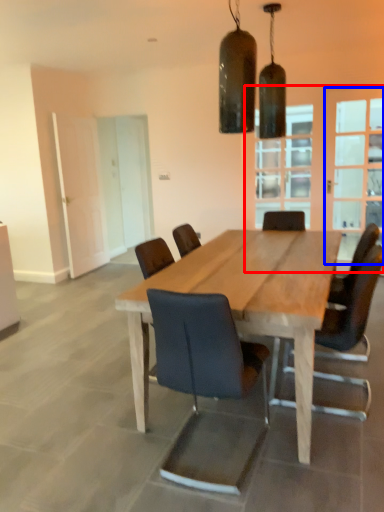
Question: Which of the following is the farthest to the observer, glass door (highlighted by a red box) or glass door (highlighted by a blue box)?

Choices:
 (A) glass door
 (B) glass door

Answer: (B)